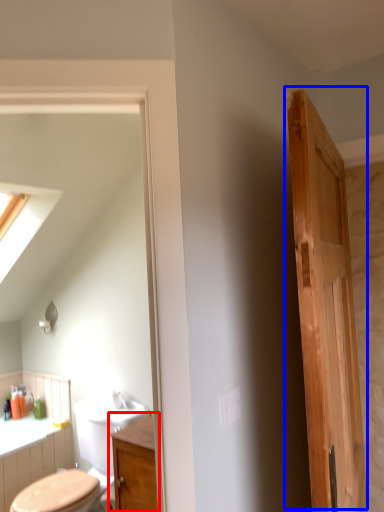
Question: Which point is further to the camera, bathroom cabinet (highlighted by a red box) or door (highlighted by a blue box)?

Choices:
 (A) bathroom cabinet
 (B) door

Answer: (A)